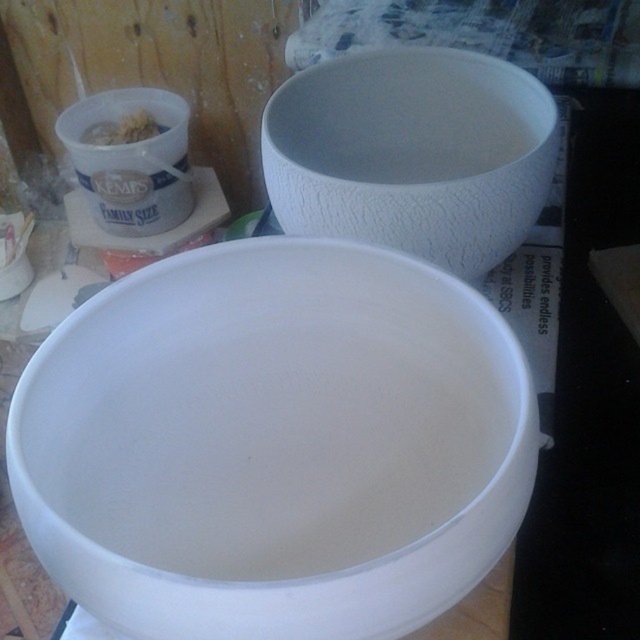
Question: Does white matte bowl at center have a greater width compared to white textured bowl at upper center?

Choices:
 (A) yes
 (B) no

Answer: (A)

Question: Is the position of white matte bowl at center less distant than that of white textured bowl at upper center?

Choices:
 (A) no
 (B) yes

Answer: (B)

Question: Among these objects, which one is farthest from the camera?

Choices:
 (A) white textured bowl at upper center
 (B) white matte bowl at center

Answer: (A)

Question: Is white matte bowl at center wider than white textured bowl at upper center?

Choices:
 (A) yes
 (B) no

Answer: (A)